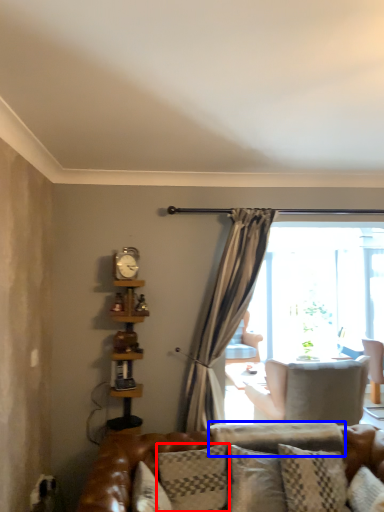
Question: Which object is further to the camera taking this photo, pillow (highlighted by a red box) or pillow (highlighted by a blue box)?

Choices:
 (A) pillow
 (B) pillow

Answer: (B)